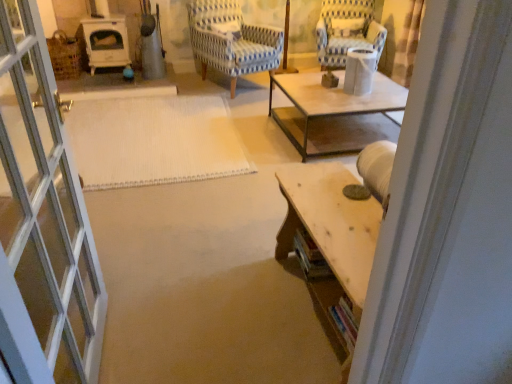
Question: Is the depth of blue and white striped fabric chair at upper right, the 2th chair when ordered from left to right, less than that of wooden table at lower right?

Choices:
 (A) no
 (B) yes

Answer: (A)

Question: Does blue and white striped fabric chair at upper right, the 2th chair when ordered from left to right, touch wooden table at lower right?

Choices:
 (A) no
 (B) yes

Answer: (A)

Question: Is wooden table at lower right inside blue and white striped fabric chair at upper right, the 2th chair when ordered from left to right?

Choices:
 (A) yes
 (B) no

Answer: (B)

Question: Is blue and white striped fabric chair at upper right, the first chair from the right, aimed at wooden table at lower right?

Choices:
 (A) no
 (B) yes

Answer: (B)

Question: Is blue and white striped fabric chair at upper right, the 2th chair when ordered from left to right, to the left of wooden table at lower right from the viewer's perspective?

Choices:
 (A) no
 (B) yes

Answer: (A)

Question: In terms of width, does wooden table at lower right look wider or thinner when compared to white woven mat at center?

Choices:
 (A) wide
 (B) thin

Answer: (B)

Question: Would you say wooden table at lower right is to the left or to the right of white woven mat at center in the picture?

Choices:
 (A) left
 (B) right

Answer: (B)

Question: From a real-world perspective, is wooden table at lower right physically located above or below white woven mat at center?

Choices:
 (A) above
 (B) below

Answer: (A)

Question: Considering their positions, is wooden table at lower right located in front of or behind white woven mat at center?

Choices:
 (A) front
 (B) behind

Answer: (A)

Question: From a real-world perspective, relative to blue and white striped fabric chair at upper right, the first chair from the right, is wooden table at lower right vertically above or below?

Choices:
 (A) above
 (B) below

Answer: (B)

Question: Considering the positions of wooden table at lower right and blue and white striped fabric chair at upper right, the 2th chair when ordered from left to right, in the image, is wooden table at lower right taller or shorter than blue and white striped fabric chair at upper right, the 2th chair when ordered from left to right,?

Choices:
 (A) short
 (B) tall

Answer: (A)

Question: Looking at their shapes, would you say wooden table at lower right is wider or thinner than blue and white striped fabric chair at upper right, the 2th chair when ordered from left to right?

Choices:
 (A) wide
 (B) thin

Answer: (B)

Question: In the image, is wooden table at lower right on the left side or the right side of blue and white striped fabric chair at upper right, the first chair from the right?

Choices:
 (A) right
 (B) left

Answer: (B)

Question: Is blue striped fabric chair at center, acting as the 2th chair starting from the right, situated inside blue and white striped fabric chair at upper right, the 2th chair when ordered from left to right, or outside?

Choices:
 (A) outside
 (B) inside

Answer: (A)

Question: Relative to blue and white striped fabric chair at upper right, the first chair from the right, is blue striped fabric chair at center, which ranks as the first chair in left-to-right order, in front or behind?

Choices:
 (A) behind
 (B) front

Answer: (B)